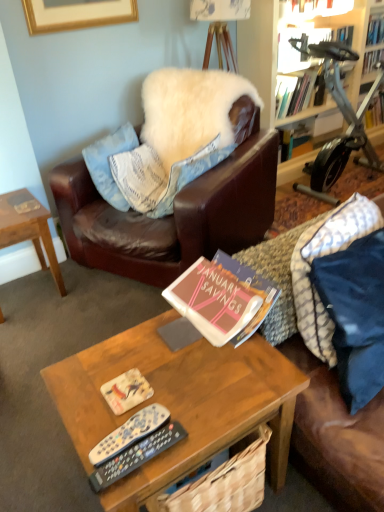
Question: From a real-world perspective, is brown woven basket at center above or below hardcover book at upper right, marked as the fifth book in a front-to-back arrangement?

Choices:
 (A) above
 (B) below

Answer: (B)

Question: From their relative heights in the image, would you say brown woven basket at center is taller or shorter than hardcover book at upper right, marked as the first book in a back-to-front arrangement?

Choices:
 (A) tall
 (B) short

Answer: (A)

Question: Estimate the real-world distances between objects in this image. Which object is closer to the hardcover book at upper right, positioned as the third book in bottom-to-top order?

Choices:
 (A) brown woven basket at center
 (B) hardcover book at upper center, the fourth book viewed from the back
 (C) woodenwoodencoffee table at center, which ranks as the second coffee table in left-to-right order
 (D) matte pink book at center, positioned as the 5th book in back-to-front order
 (E) hardcover book at upper right, which appears as the 2th book when viewed from the top

Answer: (B)

Question: Estimate the real-world distances between objects in this image. Which object is farther from the white fluffy pillow at upper center, which ranks as the 2th pillow in back-to-front order?

Choices:
 (A) wooden coffee table at left, arranged as the 1th coffee table when viewed from the back
 (B) brown woven basket at center
 (C) matte paper book cover at center
 (D) silver metallic stationary bicycle at upper right
 (E) hardcover book at upper right, positioned as the third book in bottom-to-top order

Answer: (E)